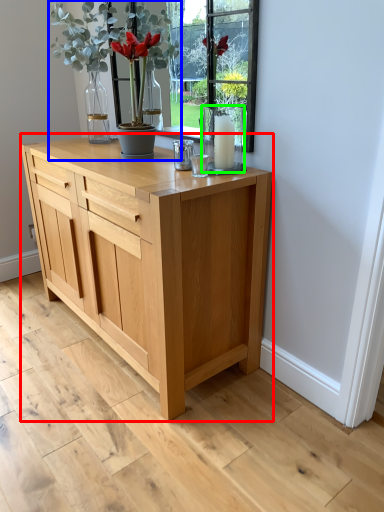
Question: Which object is the farthest from chest of drawers (highlighted by a red box)? Choose among these: houseplant (highlighted by a blue box) or glass vase (highlighted by a green box).

Choices:
 (A) houseplant
 (B) glass vase

Answer: (A)